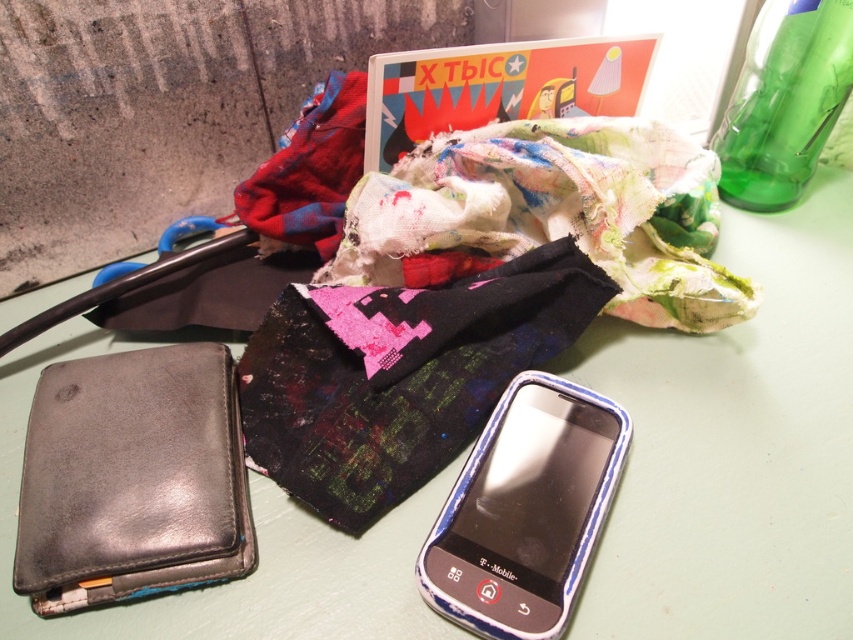
Question: Is green glass bottle at upper right thinner than red fabric at upper center?

Choices:
 (A) no
 (B) yes

Answer: (B)

Question: Which point appears closest to the camera in this image?

Choices:
 (A) (299, 230)
 (B) (509, 417)

Answer: (B)

Question: Is green glass bottle at upper right smaller than red fabric at upper center?

Choices:
 (A) no
 (B) yes

Answer: (A)

Question: Which of the following is the closest to the observer?

Choices:
 (A) dark green fabric at center
 (B) green glass bottle at upper right
 (C) multicolored patchwork cloth at center
 (D) blue plastic phone at lower right

Answer: (D)

Question: Can you confirm if dark green fabric at center is positioned above blue plastic phone at lower right?

Choices:
 (A) no
 (B) yes

Answer: (B)

Question: Based on their relative distances, which object is nearer to the red fabric at upper center?

Choices:
 (A) green glass bottle at upper right
 (B) dark green fabric at center

Answer: (B)